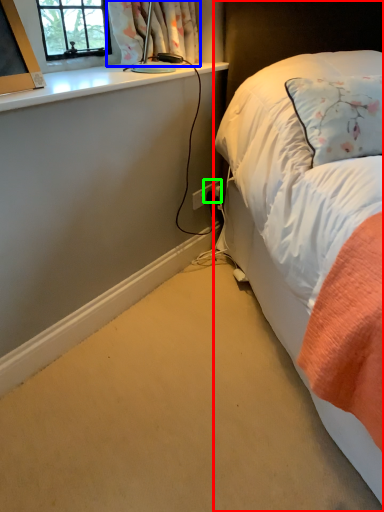
Question: Considering the real-world distances, which object is farthest from bed (highlighted by a red box)? curtain (highlighted by a blue box) or power plugs and sockets (highlighted by a green box)?

Choices:
 (A) curtain
 (B) power plugs and sockets

Answer: (B)